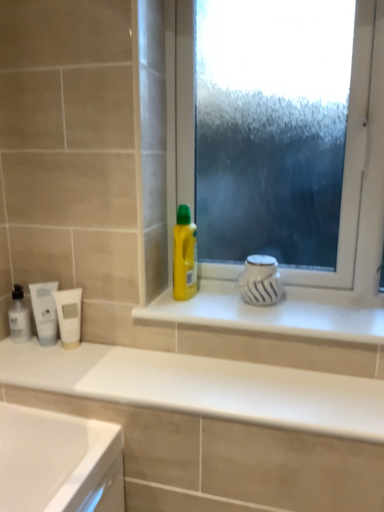
Locate an element on the screen. This screenshot has height=512, width=384. vacant area located to the right-hand side of white matte tube at lower left, which is the third mouthwash in left-to-right order is located at coordinates (116, 358).